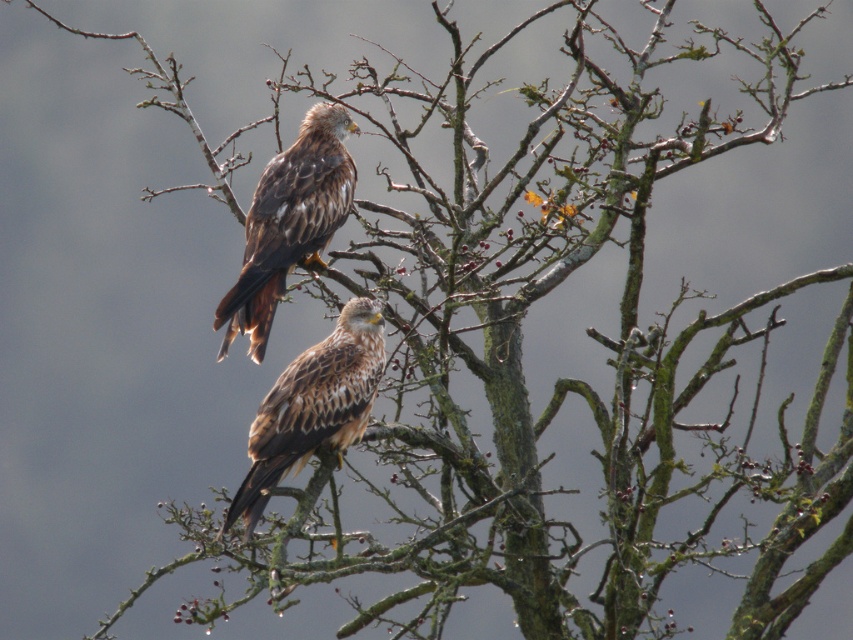
Question: Is brown speckled feathers at upper center wider than brown speckled feathers at center?

Choices:
 (A) no
 (B) yes

Answer: (A)

Question: Which of the following is the closest to the observer?

Choices:
 (A) (325, 129)
 (B) (380, 371)

Answer: (B)

Question: Is brown speckled feathers at upper center below brown speckled feathers at center?

Choices:
 (A) no
 (B) yes

Answer: (A)

Question: Does brown speckled feathers at upper center come behind brown speckled feathers at center?

Choices:
 (A) no
 (B) yes

Answer: (B)

Question: Which point is farther to the camera?

Choices:
 (A) brown speckled feathers at center
 (B) brown speckled feathers at upper center

Answer: (B)